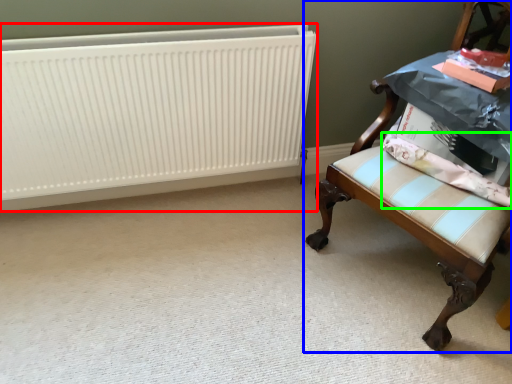
Question: Considering the real-world distances, which object is farthest from radiator (highlighted by a red box)? chair (highlighted by a blue box) or fabric (highlighted by a green box)?

Choices:
 (A) chair
 (B) fabric

Answer: (B)